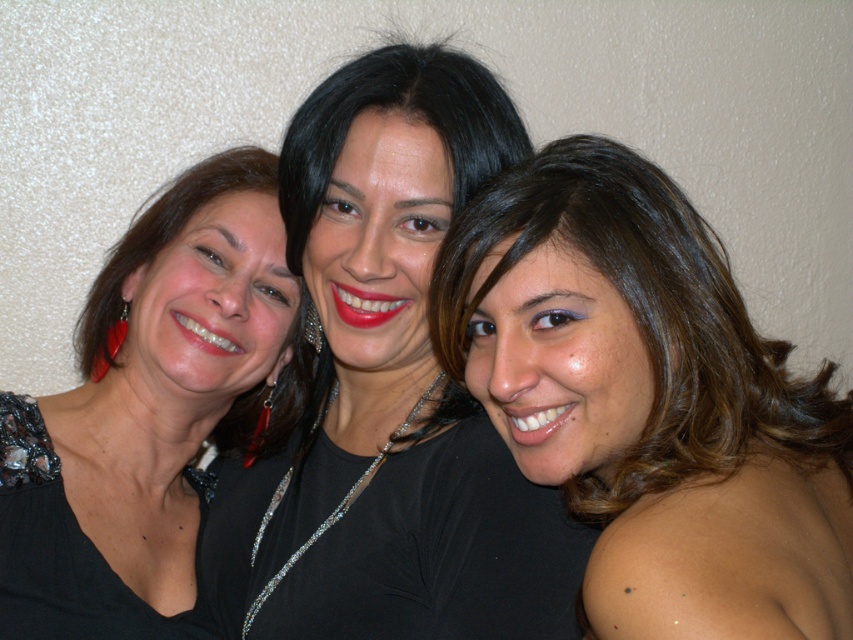
Where is `brown shiny hair at center`? The height and width of the screenshot is (640, 853). brown shiny hair at center is located at coordinates (648, 401).

Image resolution: width=853 pixels, height=640 pixels. Identify the location of brown shiny hair at center. (648, 401).

Measure the distance between matte black shirt at center and matte black dress at left.

matte black shirt at center is 7.17 inches from matte black dress at left.

Between matte black shirt at center and matte black dress at left, which one has more height?

With more height is matte black shirt at center.

Image resolution: width=853 pixels, height=640 pixels. Describe the element at coordinates (387, 392) in the screenshot. I see `matte black shirt at center` at that location.

Identify the location of matte black shirt at center. (387, 392).

Measure the distance between brown shiny hair at center and matte black shirt at center.

6.47 inches

Who is more forward, (595, 147) or (322, 308)?

Point (595, 147) is more forward.

Between point (753, 394) and point (335, 628), which one is positioned behind?

The point (335, 628) is more distant.

The image size is (853, 640). Identify the location of brown shiny hair at center. (648, 401).